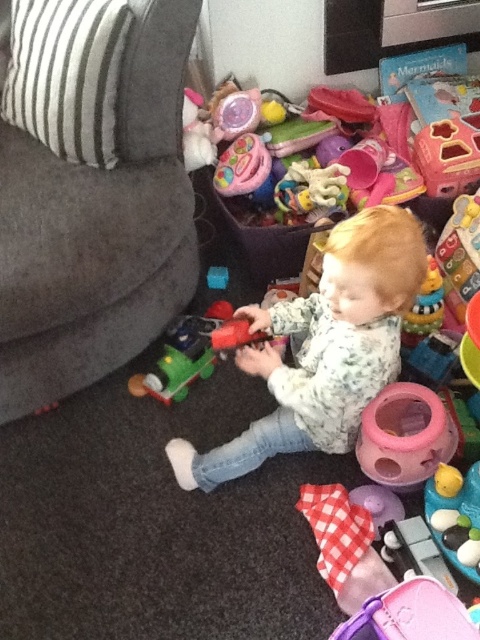
Question: Which object appears closest to the camera in this image?

Choices:
 (A) pink plastic ball at lower right
 (B) gray fabric couch at left
 (C) fluffy white sweater at center

Answer: (C)

Question: Which object appears farthest from the camera in this image?

Choices:
 (A) gray fabric couch at left
 (B) matte plastic train at lower left
 (C) fluffy white sweater at center

Answer: (B)

Question: From the image, what is the correct spatial relationship of fluffy white sweater at center in relation to pink plastic ball at lower right?

Choices:
 (A) below
 (B) above

Answer: (B)

Question: In this image, where is gray fabric couch at left located relative to fluffy white sweater at center?

Choices:
 (A) right
 (B) left

Answer: (B)

Question: Which point appears farthest from the camera in this image?

Choices:
 (A) (137, 236)
 (B) (356, 360)

Answer: (A)

Question: Does gray fabric couch at left have a larger size compared to fluffy white sweater at center?

Choices:
 (A) yes
 (B) no

Answer: (A)